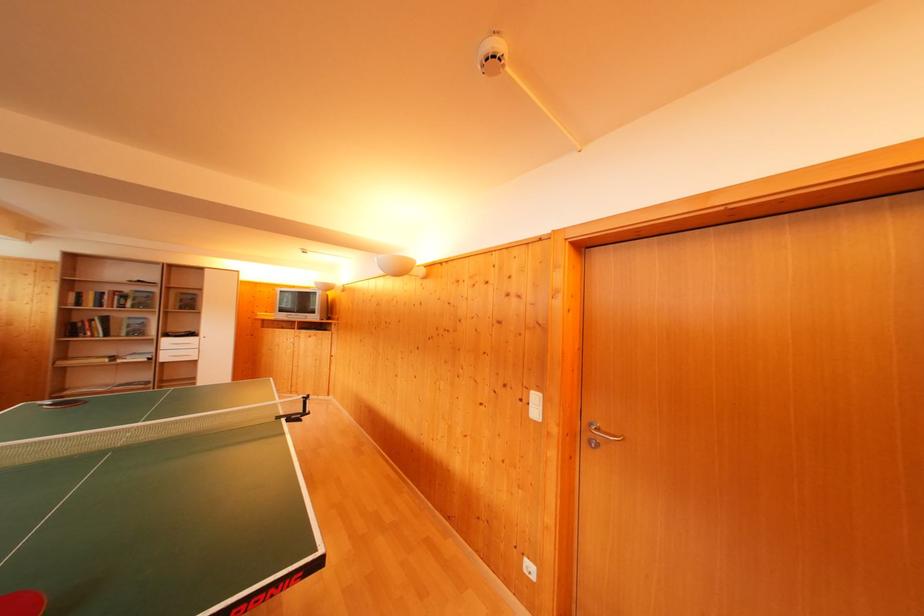
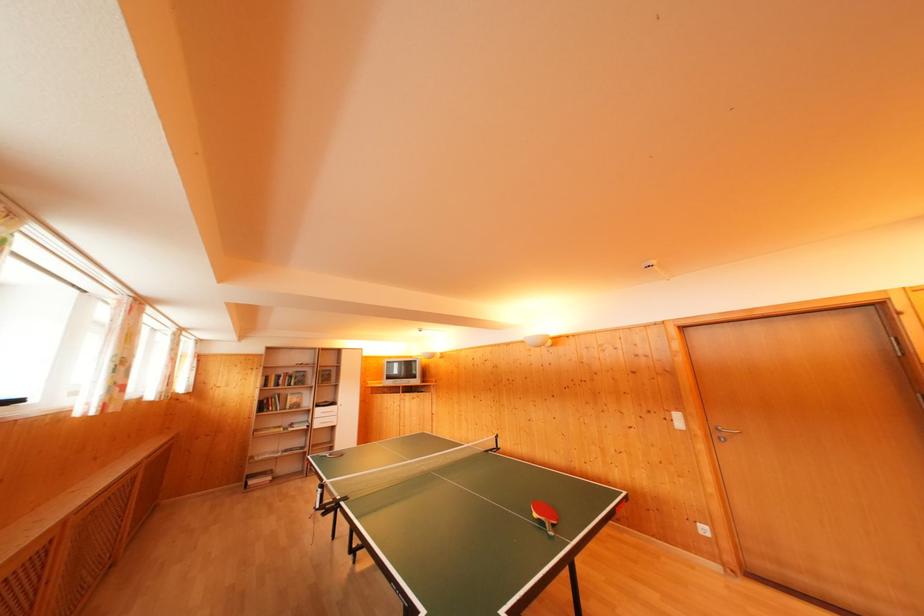
Where in the second image is the point corresponding to the point at 172,346 from the first image?

(322, 416)